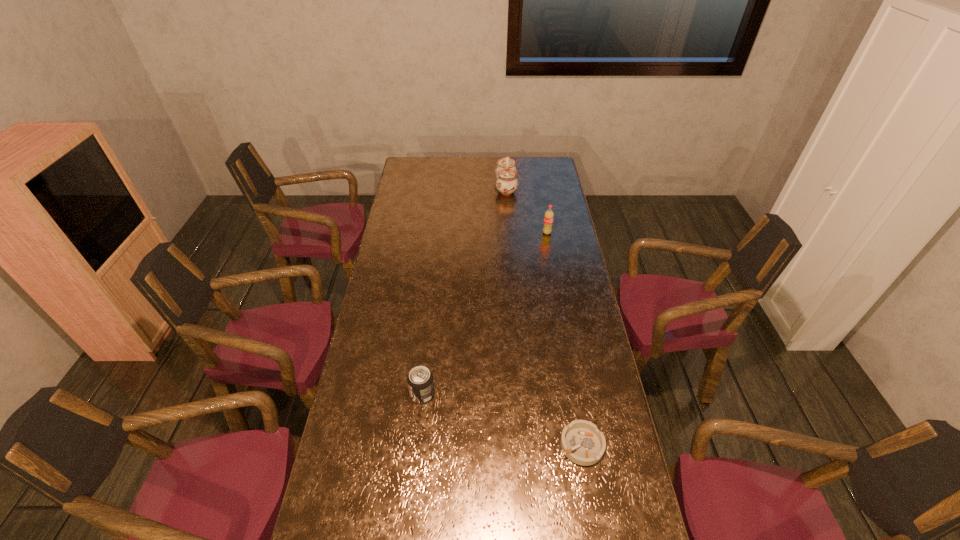
The image size is (960, 540). Identify the location of free space between the chinaware and the nearest object. (544, 316).

Identify which object is the second closest to the farthest object. Please provide its 2D coordinates. Your answer should be formatted as a tuple, i.e. [(x, y)], where the tuple contains the x and y coordinates of a point satisfying the conditions above.

[(420, 381)]

Identify the location of object that can be found as the closest to the farther soda can. This screenshot has height=540, width=960. (506, 172).

You are a GUI agent. You are given a task and a screenshot of the screen. Output one action in this format:
    pyautogui.click(x=<x>, y=<y>)
    Task: Click on the free space that satisfies the following two spatial constraints: 1. by the handle of the taller soda can; 2. on the left side of the third object from right to left
    This screenshot has height=540, width=960.
    Given the screenshot: What is the action you would take?
    pyautogui.click(x=510, y=233)

Locate an element on the screen. The width and height of the screenshot is (960, 540). vacant region that satisfies the following two spatial constraints: 1. by the handle of the second object from left to right; 2. on the right side of the shortest object is located at coordinates (526, 445).

The image size is (960, 540). I want to click on free region that satisfies the following two spatial constraints: 1. by the handle of the farthest object; 2. on the front side of the left soda can, so click(x=522, y=394).

The image size is (960, 540). I want to click on vacant point that satisfies the following two spatial constraints: 1. on the back side of the taller soda can; 2. on the left side of the ashtray, so click(x=545, y=233).

Identify the location of free space that satisfies the following two spatial constraints: 1. by the handle of the ashtray; 2. on the left side of the chinaware. (526, 445).

I want to click on vacant point that satisfies the following two spatial constraints: 1. on the back side of the right soda can; 2. by the handle of the chinaware, so click(539, 187).